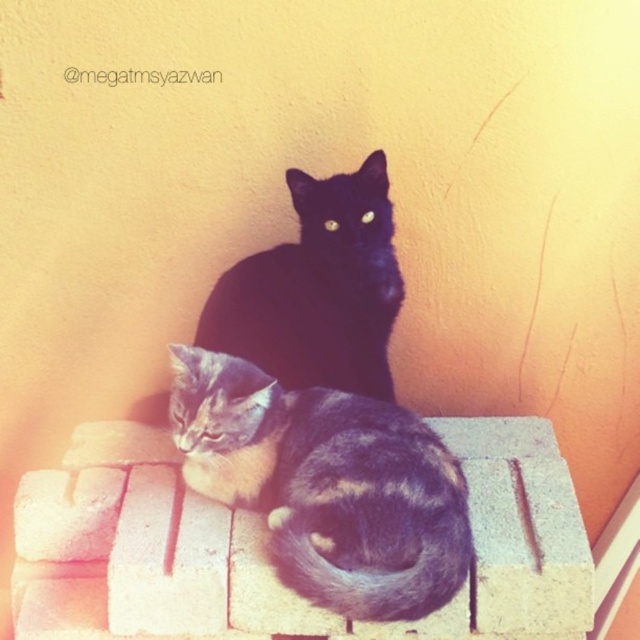
You are an observer standing in front of the image. There is a point marked at coordinates (326,484). Based on the scene description, what object is located at this point?

The point at coordinates (326,484) indicates the gray striped cat at center.

Looking at this image, you are standing in front of the image and want to determine which of the two points, point [490,544] or point [234,371], is closer to you. Based on the scene description, which point is nearer?

Point [490,544] is closer to the viewer than point [234,371] according to the description.